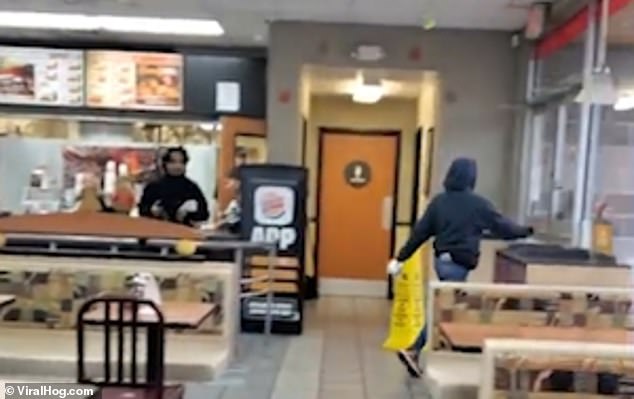
You are a GUI agent. You are given a task and a screenshot of the screen. Output one action in this format:
    pyautogui.click(x=<x>, y=<y>)
    Task: Click on the door handle
    The height and width of the screenshot is (399, 634).
    Given the screenshot: What is the action you would take?
    click(559, 210)